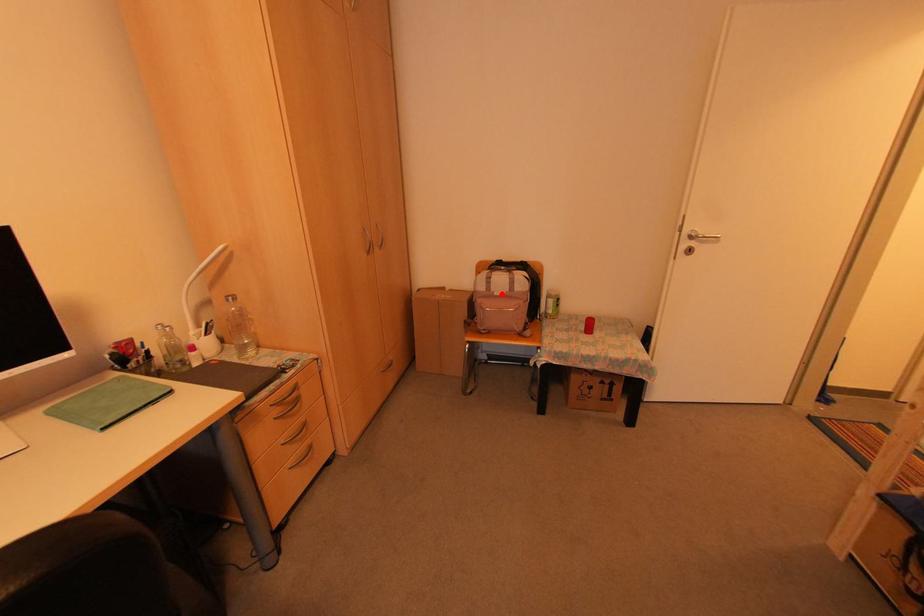
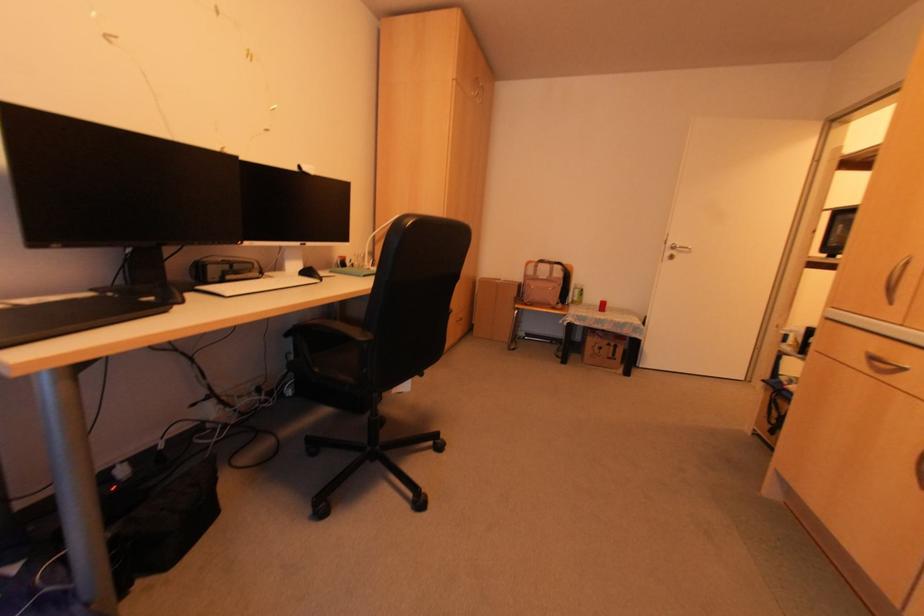
The point at the highlighted location is marked in the first image. Where is the corresponding point in the second image?

(542, 278)